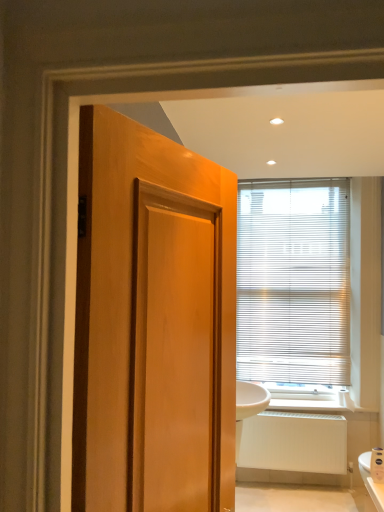
Locate an element on the screen. The height and width of the screenshot is (512, 384). free location above white matte radiator at lower right (from a real-world perspective) is located at coordinates (312, 416).